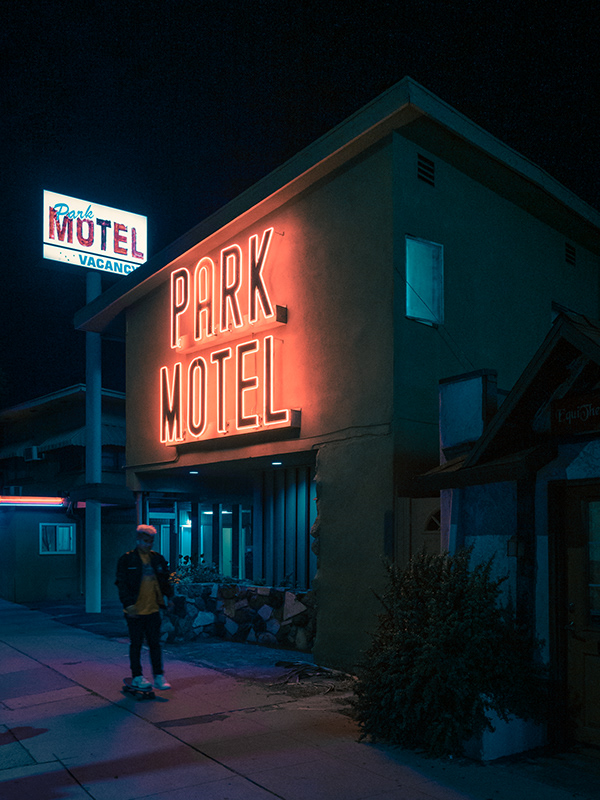
This screenshot has height=800, width=600. I want to click on window, so click(420, 272).